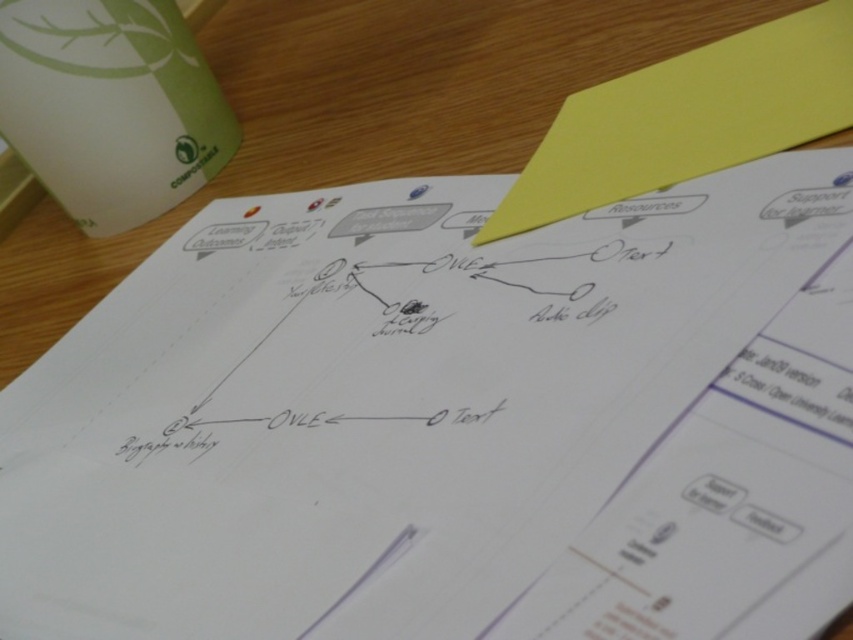
Is green matte cup at upper left above yellow paper at upper right?

Yes.

Which is above, green matte cup at upper left or yellow paper at upper right?

green matte cup at upper left is above.

Find the location of `green matte cup at upper left`. green matte cup at upper left is located at coordinates (109, 106).

Identify the location of green matte cup at upper left. (109, 106).